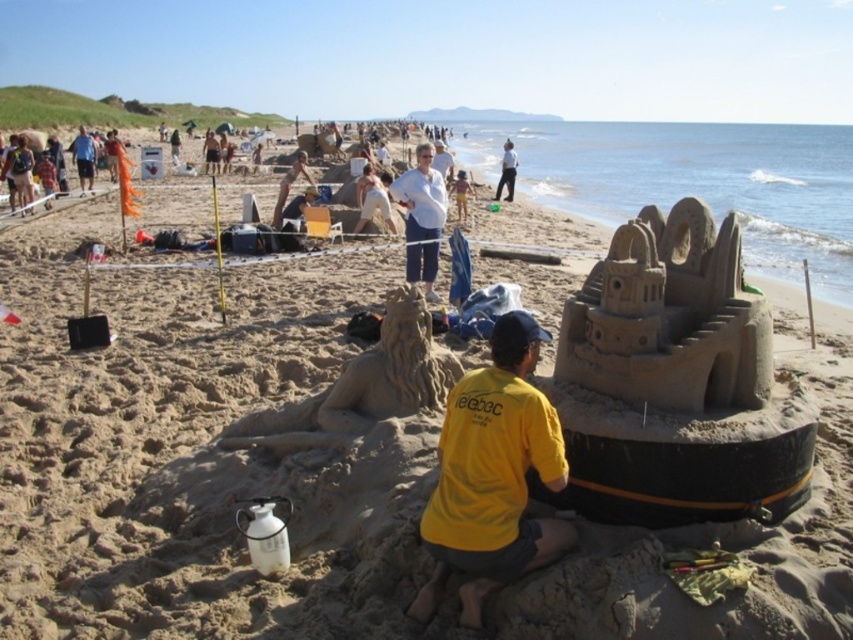
Between sandcastle at right and light blue denim shorts at center, which one is positioned lower?

sandcastle at right is lower down.

Is sandcastle at right to the right of light blue denim shorts at center from the viewer's perspective?

Yes, sandcastle at right is to the right of light blue denim shorts at center.

Identify the location of sandcastle at right. Image resolution: width=853 pixels, height=640 pixels. (669, 317).

Which is more to the right, white cotton shirt at center or white cotton shirt at upper center?

Positioned to the right is white cotton shirt at upper center.

Is white cotton shirt at center above white cotton shirt at upper center?

Incorrect, white cotton shirt at center is not positioned above white cotton shirt at upper center.

Is point (410, 232) positioned in front of point (503, 161)?

Yes, point (410, 232) is closer to viewer.

Locate an element on the screen. The image size is (853, 640). white cotton shirt at center is located at coordinates (421, 218).

Who is more forward, (x=436, y=522) or (x=428, y=172)?

Positioned in front is point (x=436, y=522).

What are the coordinates of `yellow fabric shirt at lower center` in the screenshot? It's located at (492, 476).

This screenshot has width=853, height=640. I want to click on yellow fabric shirt at lower center, so click(x=492, y=476).

Find the location of a particular element. yellow fabric shirt at lower center is located at coordinates (492, 476).